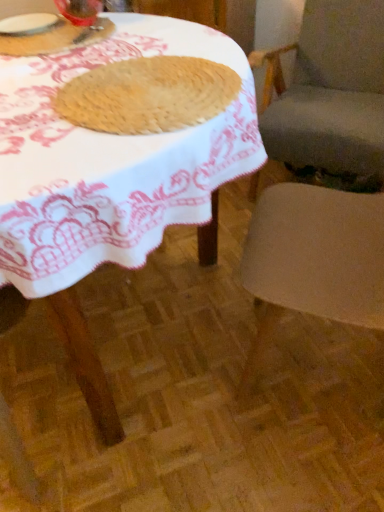
At what (x,y) coordinates should I click in order to perform the action: click on smooth beige chair at right, which is counted as the second chair, starting from the back. Please return your answer as a coordinate pair (x, y). Looking at the image, I should click on (314, 258).

Image resolution: width=384 pixels, height=512 pixels. What do you see at coordinates (79, 11) in the screenshot?
I see `transparent glass at upper left, the 1th tableware from the right` at bounding box center [79, 11].

I want to click on smooth beige chair at right, arranged as the 1th chair when viewed from the front, so click(314, 258).

Considering the sizes of wooden table at center and transparent glass at upper left, positioned as the second tableware in left-to-right order, in the image, is wooden table at center wider or thinner than transparent glass at upper left, positioned as the second tableware in left-to-right order,?

Clearly, wooden table at center has more width compared to transparent glass at upper left, positioned as the second tableware in left-to-right order.

At what (x,y) coordinates should I click in order to perform the action: click on table in front of the transparent glass at upper left, the 1th tableware from the right. Please return your answer as a coordinate pair (x, y). The width and height of the screenshot is (384, 512). Looking at the image, I should click on (107, 180).

Considering their positions, is wooden table at center located in front of or behind transparent glass at upper left, positioned as the second tableware in left-to-right order?

wooden table at center is positioned closer to the viewer than transparent glass at upper left, positioned as the second tableware in left-to-right order.

Does wooden table at center contain transparent glass at upper left, the 1th tableware from the right?

Actually, transparent glass at upper left, the 1th tableware from the right, is outside wooden table at center.

This screenshot has width=384, height=512. In order to click on breakfast that appears in front of the white glossy plate at upper left, marked as the second tableware in a right-to-left arrangement in this screenshot , I will do `click(56, 38)`.

Is there a large distance between matte glass jar at upper left and white glossy plate at upper left, marked as the second tableware in a right-to-left arrangement?

Actually, matte glass jar at upper left and white glossy plate at upper left, marked as the second tableware in a right-to-left arrangement, are a little close together.

From a real-world perspective, is matte glass jar at upper left over white glossy plate at upper left, which is the first tableware in left-to-right order?

Actually, matte glass jar at upper left is physically below white glossy plate at upper left, which is the first tableware in left-to-right order, in the real world.

Between matte glass jar at upper left and white glossy plate at upper left, marked as the second tableware in a right-to-left arrangement, which one appears on the right side from the viewer's perspective?

From the viewer's perspective, matte glass jar at upper left appears more on the right side.

Is matte glass jar at upper left at the right side of smooth beige cushion at right, which is the 2th chair in front-to-back order?

No.

How different are the orientations of matte glass jar at upper left and smooth beige cushion at right, which is the 2th chair in front-to-back order, in degrees?

83.5 degrees separate the facing orientations of matte glass jar at upper left and smooth beige cushion at right, which is the 2th chair in front-to-back order.

Can smooth beige cushion at right, which is the 2th chair in front-to-back order, be found inside matte glass jar at upper left?

Actually, smooth beige cushion at right, which is the 2th chair in front-to-back order, is outside matte glass jar at upper left.

Is matte glass jar at upper left oriented away from smooth beige cushion at right, which is the 2th chair in front-to-back order?

No, matte glass jar at upper left is not facing away from smooth beige cushion at right, which is the 2th chair in front-to-back order.

At what (x,y) coordinates should I click in order to perform the action: click on the 2nd chair below the transparent glass at upper left, positioned as the second tableware in left-to-right order (from the image's perspective). Please return your answer as a coordinate pair (x, y). The height and width of the screenshot is (512, 384). Looking at the image, I should click on (314, 258).

How many degrees apart are the facing directions of smooth beige chair at right, arranged as the 1th chair when viewed from the front, and transparent glass at upper left, positioned as the second tableware in left-to-right order?

The facing directions of smooth beige chair at right, arranged as the 1th chair when viewed from the front, and transparent glass at upper left, positioned as the second tableware in left-to-right order, are 1.41 degrees apart.

Between point (262, 315) and point (90, 12), which one is positioned in front?

Point (90, 12)

Which object is further away from the camera, smooth beige chair at right, which is counted as the second chair, starting from the back, or transparent glass at upper left, positioned as the second tableware in left-to-right order?

transparent glass at upper left, positioned as the second tableware in left-to-right order, is further from the camera.

Does white glossy plate at upper left, marked as the second tableware in a right-to-left arrangement, turn towards smooth beige chair at right, which is counted as the second chair, starting from the back?

No.

From the picture: Does white glossy plate at upper left, which is the first tableware in left-to-right order, have a smaller size compared to smooth beige chair at right, which is counted as the second chair, starting from the back?

Correct, white glossy plate at upper left, which is the first tableware in left-to-right order, occupies less space than smooth beige chair at right, which is counted as the second chair, starting from the back.

In the image, is white glossy plate at upper left, which is the first tableware in left-to-right order, on the left side or the right side of smooth beige chair at right, arranged as the 1th chair when viewed from the front?

In the image, white glossy plate at upper left, which is the first tableware in left-to-right order, appears on the left side of smooth beige chair at right, arranged as the 1th chair when viewed from the front.

From the image's perspective, is white glossy plate at upper left, which is the first tableware in left-to-right order, located above or below smooth beige chair at right, which is counted as the second chair, starting from the back?

white glossy plate at upper left, which is the first tableware in left-to-right order, is above smooth beige chair at right, which is counted as the second chair, starting from the back.

Is transparent glass at upper left, the 1th tableware from the right, at the back of smooth beige cushion at right, which is the 2th chair in front-to-back order?

No, smooth beige cushion at right, which is the 2th chair in front-to-back order, is not facing the opposite direction of transparent glass at upper left, the 1th tableware from the right.

The image size is (384, 512). I want to click on chair that is the 1st one when counting downward from the transparent glass at upper left, positioned as the second tableware in left-to-right order (from the image's perspective), so click(329, 91).

Is smooth beige cushion at right, which is the 2th chair in front-to-back order, far from transparent glass at upper left, the 1th tableware from the right?

Actually, smooth beige cushion at right, which is the 2th chair in front-to-back order, and transparent glass at upper left, the 1th tableware from the right, are a little close together.

From a real-world perspective, who is located higher, smooth beige cushion at right, which is the 2th chair in front-to-back order, or transparent glass at upper left, positioned as the second tableware in left-to-right order?

transparent glass at upper left, positioned as the second tableware in left-to-right order, is physically above.

Does transparent glass at upper left, positioned as the second tableware in left-to-right order, contain smooth beige cushion at right, the first chair in the back-to-front sequence?

No, smooth beige cushion at right, the first chair in the back-to-front sequence, is located outside of transparent glass at upper left, positioned as the second tableware in left-to-right order.

From a real-world perspective, is transparent glass at upper left, positioned as the second tableware in left-to-right order, below smooth beige cushion at right, the first chair in the back-to-front sequence?

Incorrect, from a real-world perspective, transparent glass at upper left, positioned as the second tableware in left-to-right order, is higher than smooth beige cushion at right, the first chair in the back-to-front sequence.

Considering the relative positions of transparent glass at upper left, positioned as the second tableware in left-to-right order, and smooth beige cushion at right, which is the 2th chair in front-to-back order, in the image provided, is transparent glass at upper left, positioned as the second tableware in left-to-right order, in front of smooth beige cushion at right, which is the 2th chair in front-to-back order,?

Yes, transparent glass at upper left, positioned as the second tableware in left-to-right order, is closer to the camera.

Considering the positions of points (87, 11) and (345, 38), is point (87, 11) farther from camera compared to point (345, 38)?

No, it is not.

This screenshot has width=384, height=512. Find the location of `table beneath the transparent glass at upper left, the 1th tableware from the right (from a real-world perspective)`. table beneath the transparent glass at upper left, the 1th tableware from the right (from a real-world perspective) is located at coordinates (107, 180).

At what (x,y) coordinates should I click in order to perform the action: click on breakfast below the white glossy plate at upper left, which is the first tableware in left-to-right order (from the image's perspective). Please return your answer as a coordinate pair (x, y). This screenshot has width=384, height=512. Looking at the image, I should click on (56, 38).

Looking at the image, which one is located closer to smooth beige chair at right, arranged as the 1th chair when viewed from the front, smooth beige cushion at right, the first chair in the back-to-front sequence, or golden brown textured cookie at center?

golden brown textured cookie at center is closer to smooth beige chair at right, arranged as the 1th chair when viewed from the front.

From the image, which object appears to be farther from smooth beige chair at right, arranged as the 1th chair when viewed from the front, white glossy plate at upper left, which is the first tableware in left-to-right order, or matte glass jar at upper left?

white glossy plate at upper left, which is the first tableware in left-to-right order, is positioned further to the anchor smooth beige chair at right, arranged as the 1th chair when viewed from the front.

Looking at the image, which one is located closer to smooth beige cushion at right, which is the 2th chair in front-to-back order, wooden table at center or matte glass jar at upper left?

Based on the image, wooden table at center appears to be nearer to smooth beige cushion at right, which is the 2th chair in front-to-back order.

Considering their positions, is white glossy plate at upper left, which is the first tableware in left-to-right order, positioned closer to smooth beige chair at right, arranged as the 1th chair when viewed from the front, than wooden table at center?

Based on the image, wooden table at center appears to be nearer to smooth beige chair at right, arranged as the 1th chair when viewed from the front.

From the picture: Estimate the real-world distances between objects in this image. Which object is further from wooden table at center, transparent glass at upper left, positioned as the second tableware in left-to-right order, or matte glass jar at upper left?

transparent glass at upper left, positioned as the second tableware in left-to-right order, is further to wooden table at center.

From the image, which object appears to be nearer to smooth beige chair at right, arranged as the 1th chair when viewed from the front, wooden table at center or matte glass jar at upper left?

wooden table at center lies closer to smooth beige chair at right, arranged as the 1th chair when viewed from the front, than the other object.

Consider the image. When comparing their distances from golden brown textured cookie at center, does white glossy plate at upper left, which is the first tableware in left-to-right order, or wooden table at center seem further?

The object further to golden brown textured cookie at center is white glossy plate at upper left, which is the first tableware in left-to-right order.

Looking at the image, which one is located closer to matte glass jar at upper left, wooden table at center or transparent glass at upper left, the 1th tableware from the right?

The object closer to matte glass jar at upper left is transparent glass at upper left, the 1th tableware from the right.

Identify the location of chocolate chip cookie situated between matte glass jar at upper left and smooth beige chair at right, arranged as the 1th chair when viewed from the front, from left to right. The height and width of the screenshot is (512, 384). (148, 95).

Image resolution: width=384 pixels, height=512 pixels. In order to click on chocolate chip cookie positioned between wooden table at center and transparent glass at upper left, the 1th tableware from the right, from near to far in this screenshot , I will do `click(148, 95)`.

This screenshot has width=384, height=512. Identify the location of chocolate chip cookie situated between matte glass jar at upper left and smooth beige cushion at right, the first chair in the back-to-front sequence, from left to right. (148, 95).

Identify the location of chocolate chip cookie between white glossy plate at upper left, marked as the second tableware in a right-to-left arrangement, and smooth beige chair at right, arranged as the 1th chair when viewed from the front, from left to right. The image size is (384, 512). (148, 95).